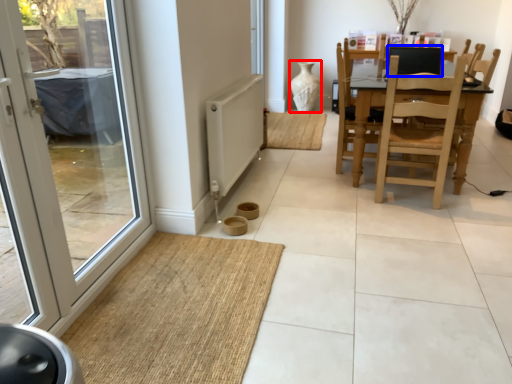
Question: Which of the following is the farthest to the observer, vase (highlighted by a red box) or back (highlighted by a blue box)?

Choices:
 (A) vase
 (B) back

Answer: (A)